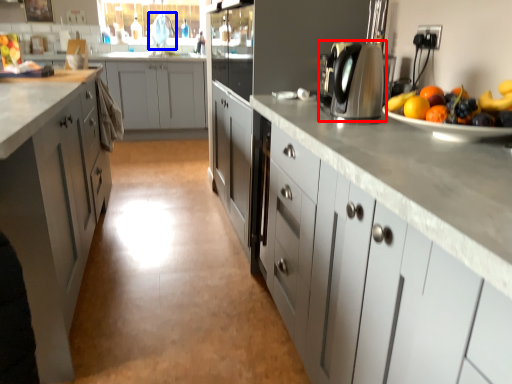
Question: Which object is further to the camera taking this photo, home appliance (highlighted by a red box) or faucet (highlighted by a blue box)?

Choices:
 (A) home appliance
 (B) faucet

Answer: (B)